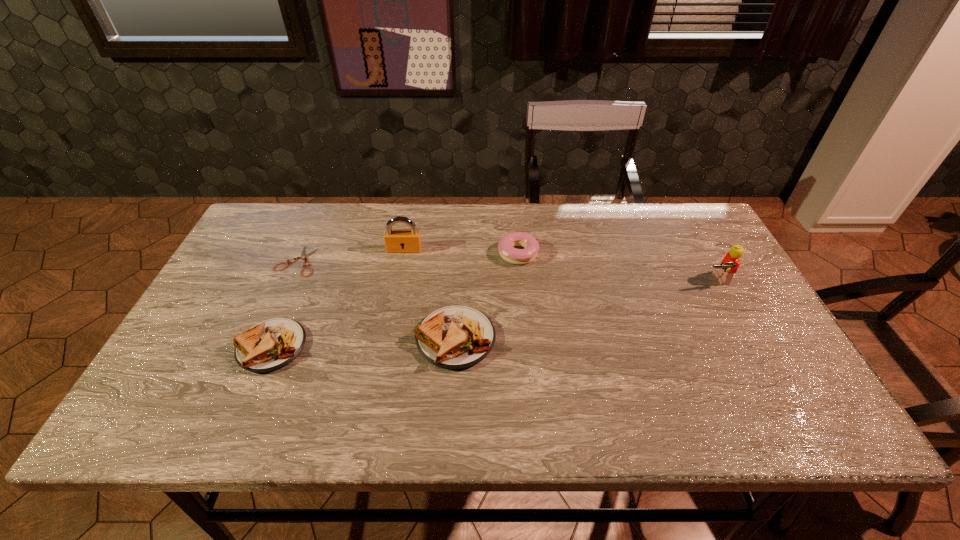
With all sandwichs evenly spaced, where should an extra sandwich be placed on the right to continue the pattern? Please point out a vacant space. Please provide its 2D coordinates. Your answer should be formatted as a tuple, i.e. [(x, y)], where the tuple contains the x and y coordinates of a point satisfying the conditions above.

[(634, 331)]